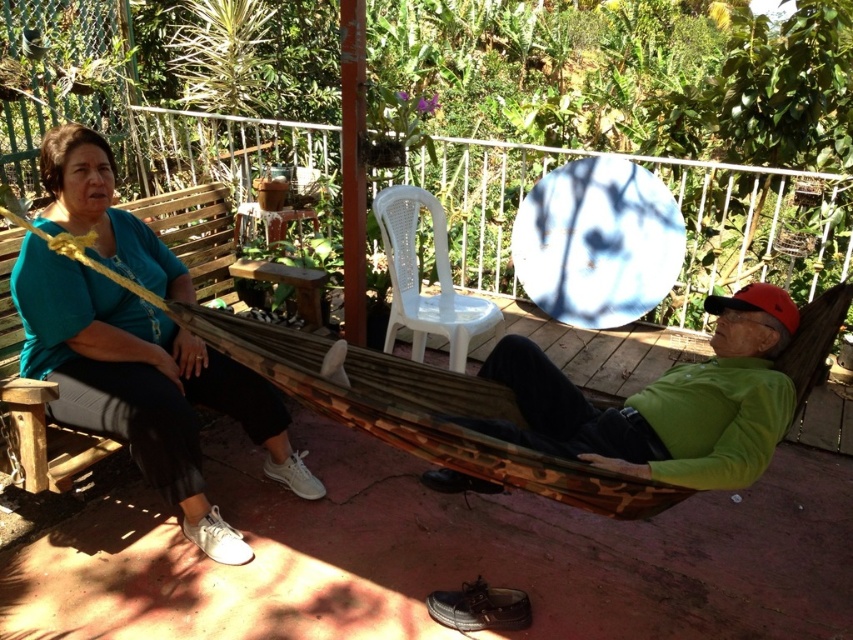
Does point (247, 362) lie in front of point (537, 371)?

That is True.

Who is shorter, camouflage fabric hammock at center or green matte shirt at right?

With less height is green matte shirt at right.

Is point (577, 468) positioned after point (711, 310)?

No, it is in front of (711, 310).

Find the location of a particular element. Image resolution: width=853 pixels, height=640 pixels. camouflage fabric hammock at center is located at coordinates coord(134,340).

From the picture: Can you confirm if camouflage fabric hammock at center is wider than teal fabric shirt at upper left?

Correct, the width of camouflage fabric hammock at center exceeds that of teal fabric shirt at upper left.

Does camouflage fabric hammock at center appear on the left side of teal fabric shirt at upper left?

No, camouflage fabric hammock at center is not to the left of teal fabric shirt at upper left.

This screenshot has height=640, width=853. What do you see at coordinates (134, 340) in the screenshot? I see `camouflage fabric hammock at center` at bounding box center [134, 340].

At what (x,y) coordinates should I click in order to perform the action: click on camouflage fabric hammock at center. Please return your answer as a coordinate pair (x, y). The image size is (853, 640). Looking at the image, I should click on (134, 340).

The image size is (853, 640). I want to click on green matte shirt at right, so click(665, 403).

Is green matte shirt at right to the left of wooden bench at left from the viewer's perspective?

Incorrect, green matte shirt at right is not on the left side of wooden bench at left.

What do you see at coordinates (665, 403) in the screenshot? I see `green matte shirt at right` at bounding box center [665, 403].

You are a GUI agent. You are given a task and a screenshot of the screen. Output one action in this format:
    pyautogui.click(x=<x>, y=<y>)
    Task: Click on the green matte shirt at right
    The image size is (853, 640).
    Given the screenshot: What is the action you would take?
    pyautogui.click(x=665, y=403)